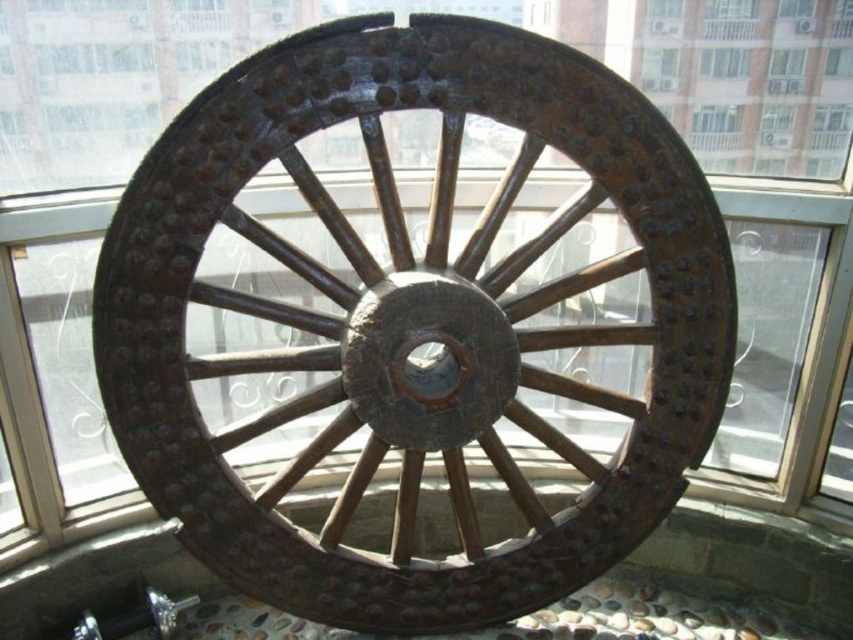
You are standing in a room with a rusty wood wagon wheel at center and a clear glass window at upper center. Which object is positioned higher up in the room?

The clear glass window at upper center is positioned higher up in the room than the rusty wood wagon wheel at center.

You are an engineer inspecting the antique wooden wheel. You notice two points marked on the wheel at coordinates point (564, 296) and point (732, 65). Which of these points is positioned closer to your viewpoint?

Point (564, 296) is closer to the viewer than point (732, 65).

You are standing in a room where you can see the rusty wood wagon wheel at center and the clear glass window at upper center. If you want to look through the window, which object would you need to move your gaze past first?

The rusty wood wagon wheel at center is in front of the clear glass window at upper center, so you would need to move your gaze past the rusty wood wagon wheel at center first to look through the window.